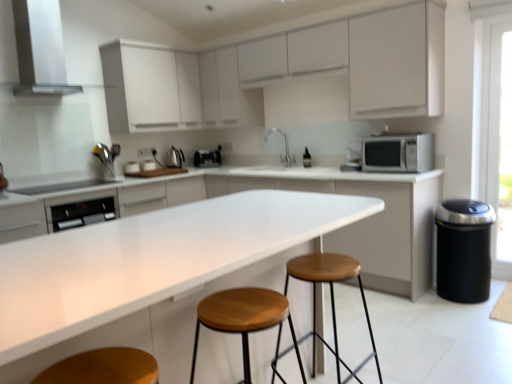
Question: Considering the relative sizes of satin silver kettle at upper left, arranged as the second appliance when viewed from the top, and silver metallic microwave at right in the image provided, is satin silver kettle at upper left, arranged as the second appliance when viewed from the top, taller than silver metallic microwave at right?

Choices:
 (A) no
 (B) yes

Answer: (A)

Question: Is satin silver kettle at upper left, which is the second appliance from left to right, in front of silver metallic microwave at right?

Choices:
 (A) yes
 (B) no

Answer: (B)

Question: Is satin silver kettle at upper left, positioned as the third appliance in front-to-back order, to the left of silver metallic microwave at right from the viewer's perspective?

Choices:
 (A) no
 (B) yes

Answer: (B)

Question: From a real-world perspective, is satin silver kettle at upper left, which is the second appliance from left to right, on top of silver metallic microwave at right?

Choices:
 (A) yes
 (B) no

Answer: (B)

Question: From the image's perspective, is satin silver kettle at upper left, placed as the 2th appliance when sorted from back to front, above silver metallic microwave at right?

Choices:
 (A) yes
 (B) no

Answer: (A)

Question: Is satin silver kettle at upper left, which is the second appliance from left to right, far away from silver metallic microwave at right?

Choices:
 (A) no
 (B) yes

Answer: (B)

Question: From a real-world perspective, is satin nickel faucet at center below white matte cabinet at upper center, placed as the 2th cabinetry when sorted from bottom to top?

Choices:
 (A) no
 (B) yes

Answer: (B)

Question: From the image's perspective, is satin nickel faucet at center on white matte cabinet at upper center, the second cabinetry when ordered from top to bottom?

Choices:
 (A) no
 (B) yes

Answer: (A)

Question: Could you tell me if satin nickel faucet at center is facing white matte cabinet at upper center, placed as the 2th cabinetry when sorted from bottom to top?

Choices:
 (A) yes
 (B) no

Answer: (B)

Question: Is satin nickel faucet at center oriented away from white matte cabinet at upper center, placed as the 2th cabinetry when sorted from bottom to top?

Choices:
 (A) yes
 (B) no

Answer: (B)

Question: Can you see satin nickel faucet at center touching white matte cabinet at upper center, placed as the 2th cabinetry when sorted from bottom to top?

Choices:
 (A) no
 (B) yes

Answer: (A)

Question: Considering the relative positions of satin nickel faucet at center and white matte cabinet at upper center, the second cabinetry when ordered from top to bottom, in the image provided, is satin nickel faucet at center to the right of white matte cabinet at upper center, the second cabinetry when ordered from top to bottom, from the viewer's perspective?

Choices:
 (A) yes
 (B) no

Answer: (A)

Question: Can you confirm if silver metallic microwave at right is positioned to the right of satin black toaster at center, the fourth appliance viewed from the front?

Choices:
 (A) yes
 (B) no

Answer: (A)